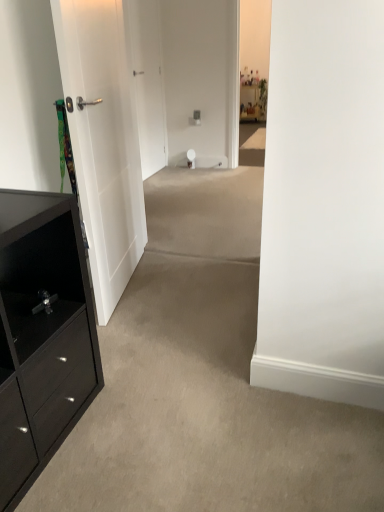
Question: From their relative heights in the image, would you say white smooth door at center, the second door in the front-to-back sequence, is taller or shorter than white matte door at left, arranged as the first door when viewed from the front?

Choices:
 (A) tall
 (B) short

Answer: (A)

Question: From the image's perspective, is white smooth door at center, the second door in the front-to-back sequence, located above or below white matte door at left, arranged as the first door when viewed from the front?

Choices:
 (A) above
 (B) below

Answer: (A)

Question: Estimate the real-world distances between objects in this image. Which object is closer to the black matte cabinet at left?

Choices:
 (A) white matte door at left, arranged as the first door when viewed from the front
 (B) white smooth door at center, the second door in the front-to-back sequence

Answer: (A)

Question: Estimate the real-world distances between objects in this image. Which object is farther from the black matte cabinet at left?

Choices:
 (A) white matte door at left, arranged as the first door when viewed from the front
 (B) white smooth door at center, which is the 1th door from back to front

Answer: (B)